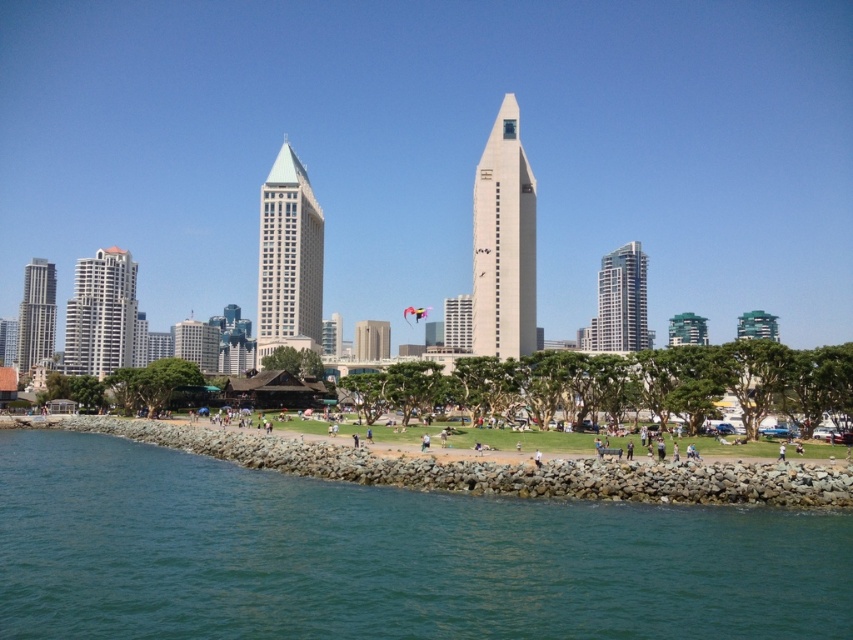
Does white glass tower at center have a greater width compared to smooth beige tower at center?

Indeed, white glass tower at center has a greater width compared to smooth beige tower at center.

Does white glass tower at center appear over smooth beige tower at center?

Result: Yes.

Between point (502, 138) and point (360, 337), which one is positioned behind?

The point (360, 337) is behind.

This screenshot has width=853, height=640. I want to click on white glass tower at center, so click(503, 243).

Is point (509, 193) less distant than point (305, 212)?

Yes, point (509, 193) is closer to viewer.

Looking at this image, can you confirm if white glass tower at center is positioned to the left of matte glass skyscraper at center?

Incorrect, white glass tower at center is not on the left side of matte glass skyscraper at center.

At what (x,y) coordinates should I click in order to perform the action: click on white glass tower at center. Please return your answer as a coordinate pair (x, y). This screenshot has height=640, width=853. Looking at the image, I should click on (503, 243).

Image resolution: width=853 pixels, height=640 pixels. What are the coordinates of `white glass tower at center` in the screenshot? It's located at (503, 243).

In the scene shown: Which is more to the right, smooth glass skyscraper at right or smooth beige tower at center?

From the viewer's perspective, smooth glass skyscraper at right appears more on the right side.

Between smooth glass skyscraper at right and smooth beige tower at center, which one appears on the left side from the viewer's perspective?

Positioned to the left is smooth beige tower at center.

At what (x,y) coordinates should I click in order to perform the action: click on smooth glass skyscraper at right. Please return your answer as a coordinate pair (x, y). This screenshot has height=640, width=853. Looking at the image, I should click on (621, 300).